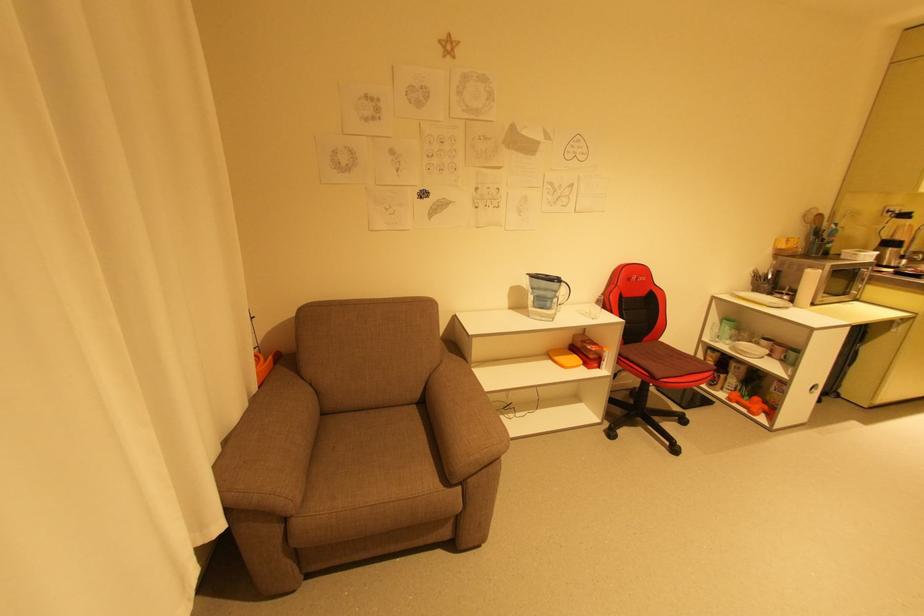
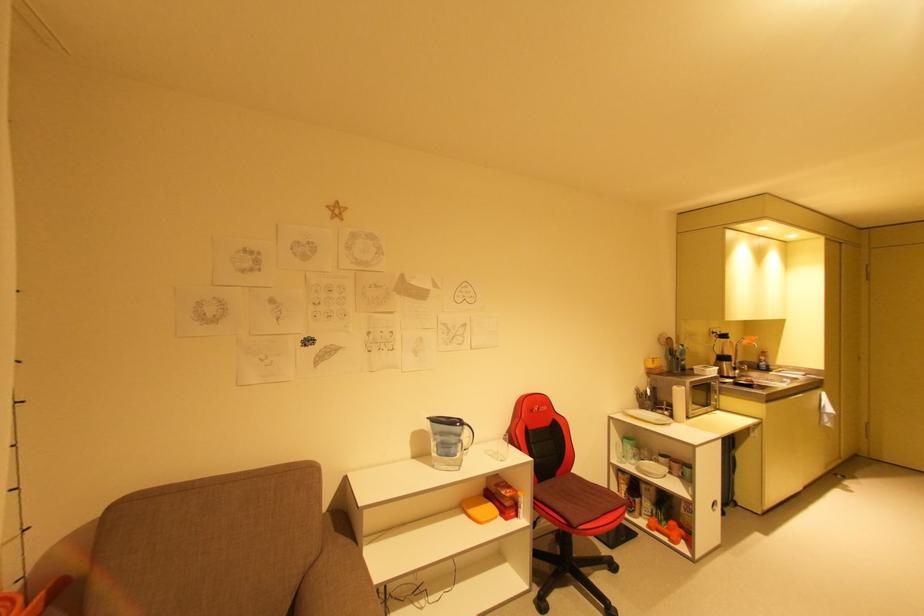
Locate, in the second image, the point that corresponds to the point at 433,376 in the first image.

(306, 578)